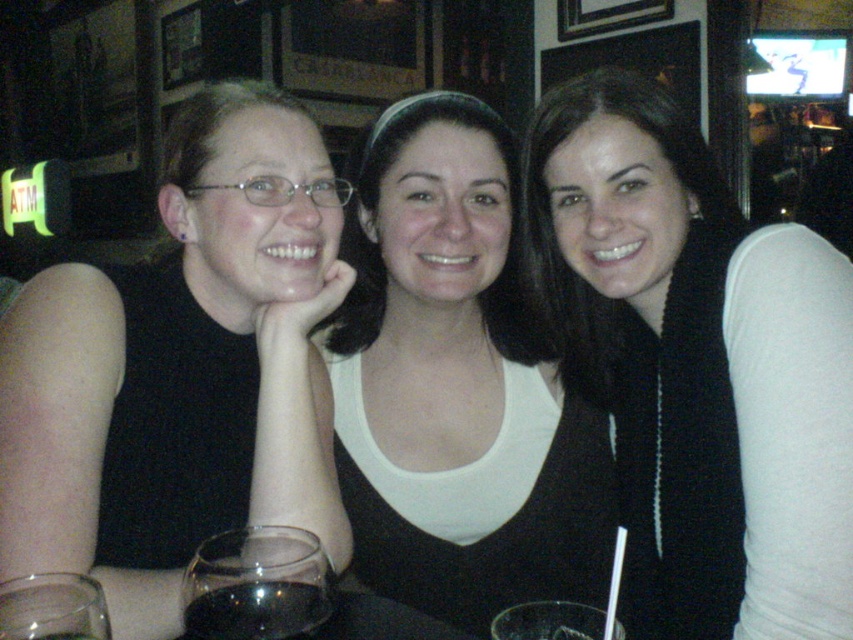
How far apart are matte black shirt at left and white matte tank top at center?

The distance of matte black shirt at left from white matte tank top at center is 8.25 inches.

Measure the distance between matte black shirt at left and camera.

They are 30.70 inches apart.

Is point (74, 324) farther from viewer compared to point (460, 250)?

No, (74, 324) is closer to viewer.

Find the location of a particular element. matte black shirt at left is located at coordinates (181, 369).

Does transparent glass at lower center appear on the right side of transparent glass at lower left?

Correct, you'll find transparent glass at lower center to the right of transparent glass at lower left.

What do you see at coordinates (257, 584) in the screenshot? Image resolution: width=853 pixels, height=640 pixels. I see `transparent glass at lower center` at bounding box center [257, 584].

Where is `transparent glass at lower center`? This screenshot has width=853, height=640. transparent glass at lower center is located at coordinates (257, 584).

Which is above, white matte tank top at center or transparent glass at lower left?

Positioned higher is white matte tank top at center.

Which is behind, point (430, 108) or point (59, 612)?

The point (430, 108) is more distant.

Is point (433, 552) farther from camera compared to point (90, 608)?

Yes, point (433, 552) is behind point (90, 608).

Identify the location of white matte tank top at center. This screenshot has width=853, height=640. (457, 385).